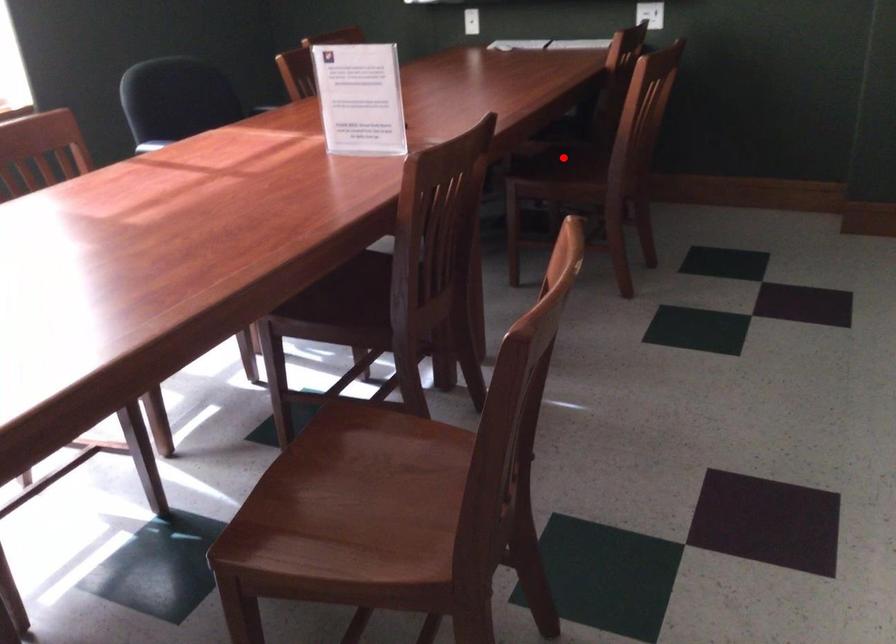
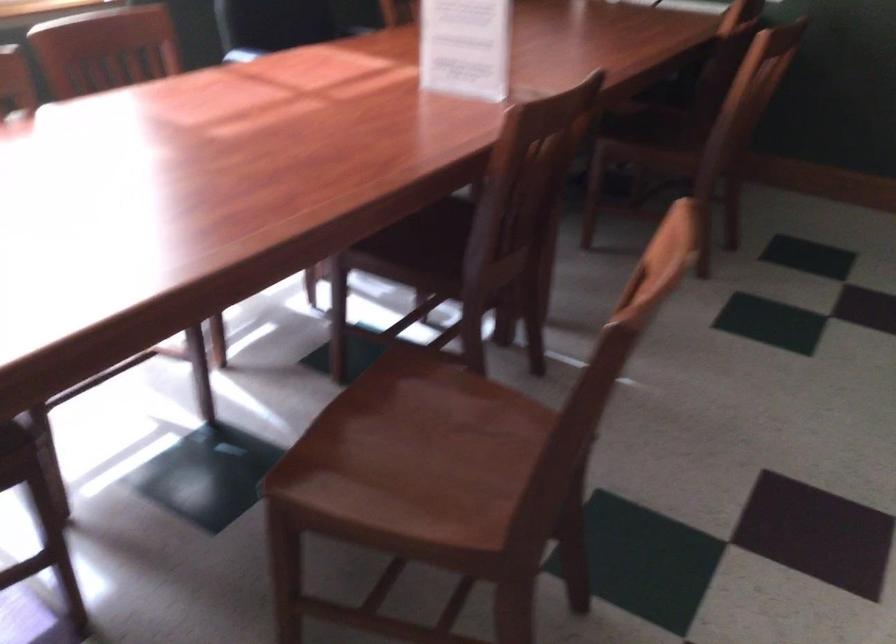
Find the pixel in the second image that matches the highlighted location in the first image.

(659, 122)